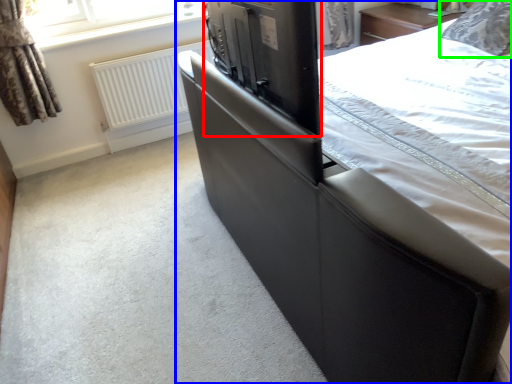
Question: Which object is the closest to the appliance (highlighted by a red box)? Choose among these: bed (highlighted by a blue box) or pillow (highlighted by a green box).

Choices:
 (A) bed
 (B) pillow

Answer: (A)